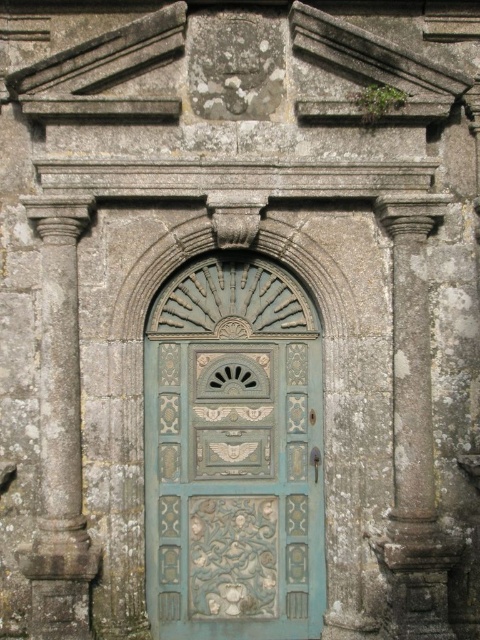
Is point (407, 360) positioned behind point (64, 534)?

Yes, point (407, 360) is farther from viewer.

Which is below, gray stone column at right or gray stone column at left?

gray stone column at left is below.

From the picture: Who is more distant from viewer, (386, 545) or (86, 544)?

The point (386, 545) is behind.

Where is `gray stone column at right`? This screenshot has width=480, height=640. gray stone column at right is located at coordinates (414, 433).

Is blue carved door at center wider than gray stone column at right?

Yes, blue carved door at center is wider than gray stone column at right.

Locate an element on the screen. The width and height of the screenshot is (480, 640). blue carved door at center is located at coordinates (233, 454).

Who is more distant from viewer, [241,376] or [408,422]?

Positioned behind is point [241,376].

At what (x,y) coordinates should I click in order to perform the action: click on blue carved door at center. Please return your answer as a coordinate pair (x, y). The width and height of the screenshot is (480, 640). Looking at the image, I should click on coord(233,454).

Between blue carved door at center and gray stone column at left, which one is positioned higher?

gray stone column at left is higher up.

Can you confirm if blue carved door at center is positioned below gray stone column at left?

Yes, blue carved door at center is below gray stone column at left.

Measure the distance between point (187, 604) and camera.

The distance of point (187, 604) from camera is 24.65 feet.

The image size is (480, 640). I want to click on blue carved door at center, so click(x=233, y=454).